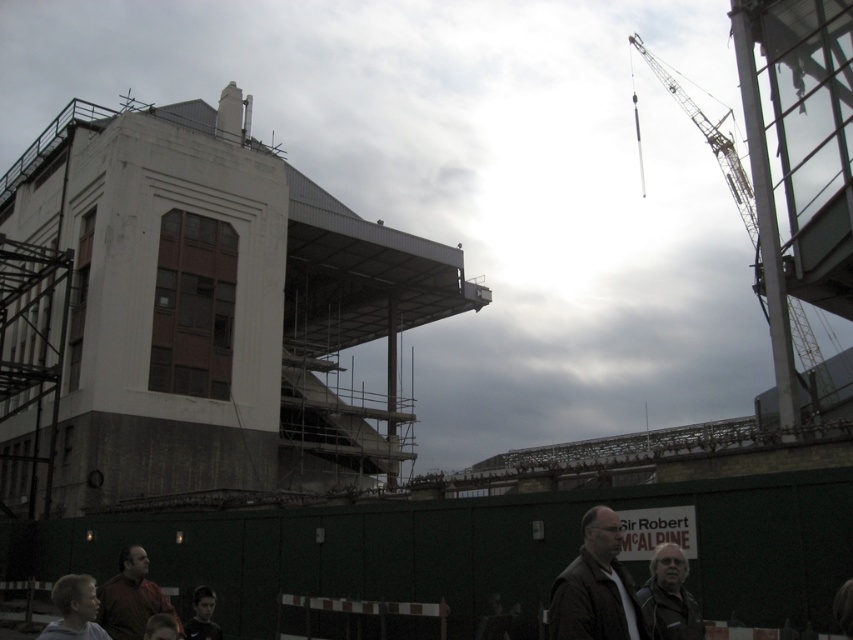
Question: Can you confirm if dark gray jacket at lower right is wider than smooth skin face at lower left?

Choices:
 (A) yes
 (B) no

Answer: (B)

Question: Estimate the real-world distances between objects in this image. Which object is farther from the dark brown leather jacket at lower right?

Choices:
 (A) yellow metallic crane at upper right
 (B) dark gray jacket at lower right

Answer: (A)

Question: Which object appears farthest from the camera in this image?

Choices:
 (A) white concrete building at left
 (B) yellow metallic crane at upper right
 (C) dark brown leather jacket at lower right

Answer: (A)

Question: Is white concrete building at left below light brown hair at lower left?

Choices:
 (A) yes
 (B) no

Answer: (B)

Question: Among these objects, which one is nearest to the camera?

Choices:
 (A) dark gray jacket at lower right
 (B) dark brown leather jacket at lower right
 (C) white concrete building at left

Answer: (A)

Question: Is brown leather jacket at lower left below dark gray jacket at lower right?

Choices:
 (A) no
 (B) yes

Answer: (B)